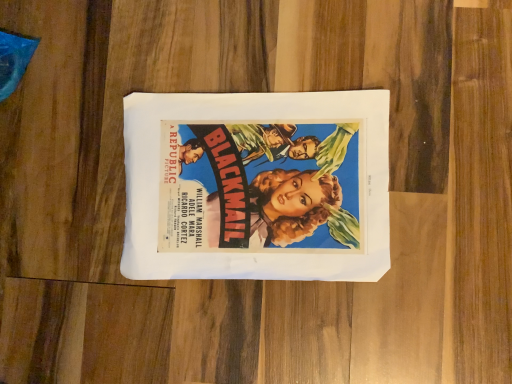
This screenshot has width=512, height=384. Describe the element at coordinates (257, 186) in the screenshot. I see `matte paper poster at center` at that location.

Identify the location of matte paper poster at center. The height and width of the screenshot is (384, 512). (257, 186).

Locate an element on the screen. matte paper poster at center is located at coordinates (257, 186).